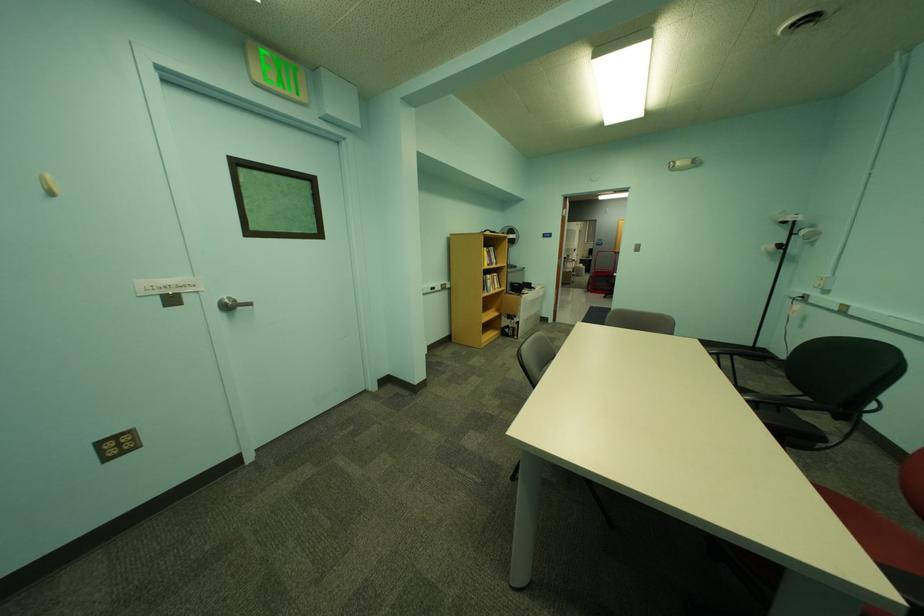
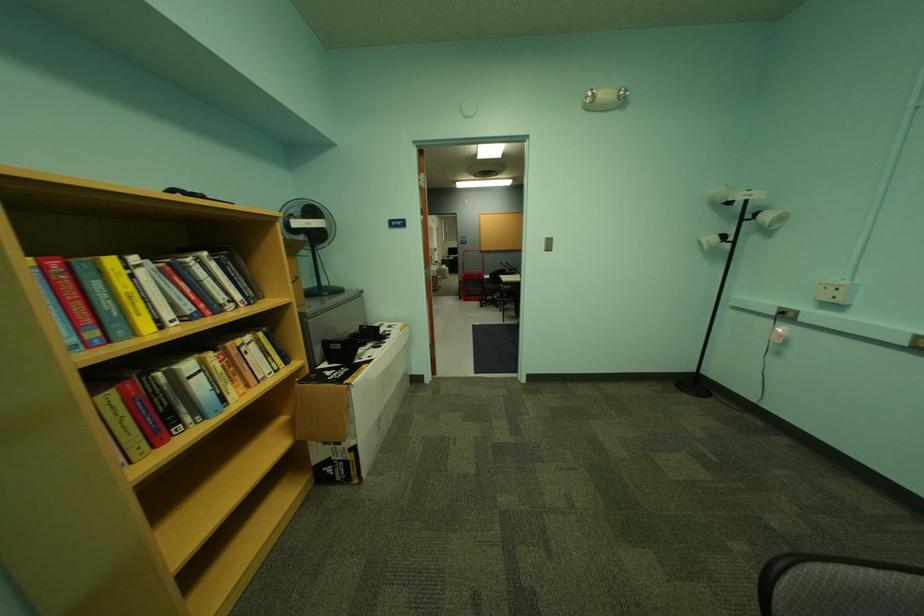
Where in the second image is the point corresponding to the point at 540,286 from the first image?

(386, 330)